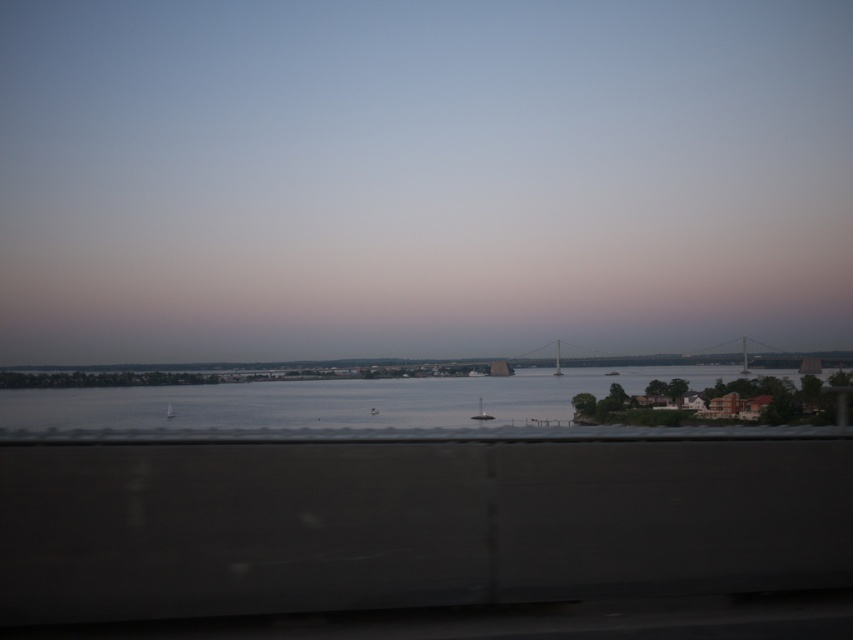
Question: Which of the following is the farthest from the observer?

Choices:
 (A) metallic gray bridge at center
 (B) clear water at center

Answer: (A)

Question: Can you confirm if clear water at center is positioned to the left of metallic gray bridge at center?

Choices:
 (A) yes
 (B) no

Answer: (A)

Question: Can you confirm if clear water at center is bigger than metallic gray bridge at center?

Choices:
 (A) yes
 (B) no

Answer: (A)

Question: Which of the following is the closest to the observer?

Choices:
 (A) (521, 406)
 (B) (752, 364)

Answer: (A)

Question: Is clear water at center bigger than metallic gray bridge at center?

Choices:
 (A) no
 (B) yes

Answer: (B)